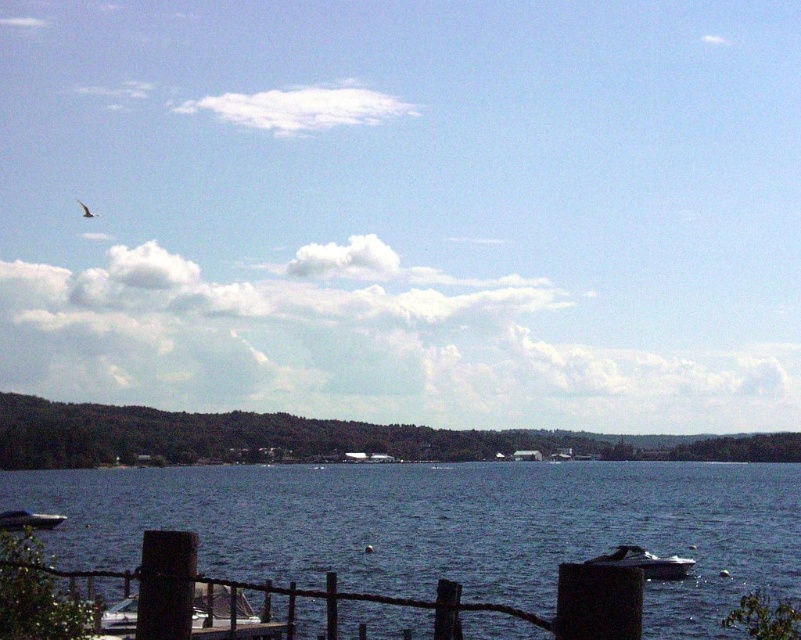
Question: Does metallic silver boat at lower left have a lesser width compared to shiny silver boat at lower right?

Choices:
 (A) yes
 (B) no

Answer: (A)

Question: Which is nearer to the shiny silver boat at lower right?

Choices:
 (A) metallic silver boat at lower left
 (B) blue water at center
 (C) metallic blue boat at lower left
 (D) smooth gray bird at upper left

Answer: (A)

Question: Among these points, which one is farthest from the camera?

Choices:
 (A) (641, 513)
 (B) (89, 209)
 (C) (14, 518)

Answer: (B)

Question: Can you confirm if metallic silver boat at lower left is smaller than smooth gray bird at upper left?

Choices:
 (A) no
 (B) yes

Answer: (B)

Question: Based on their relative distances, which object is farther from the shiny silver boat at lower right?

Choices:
 (A) metallic blue boat at lower left
 (B) smooth gray bird at upper left

Answer: (B)

Question: Does metallic silver boat at lower left appear over shiny silver boat at lower right?

Choices:
 (A) no
 (B) yes

Answer: (B)